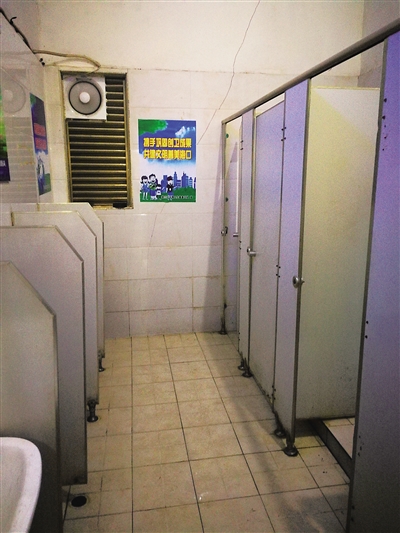
The width and height of the screenshot is (400, 533). In order to click on basin in this screenshot , I will do `click(10, 499)`.